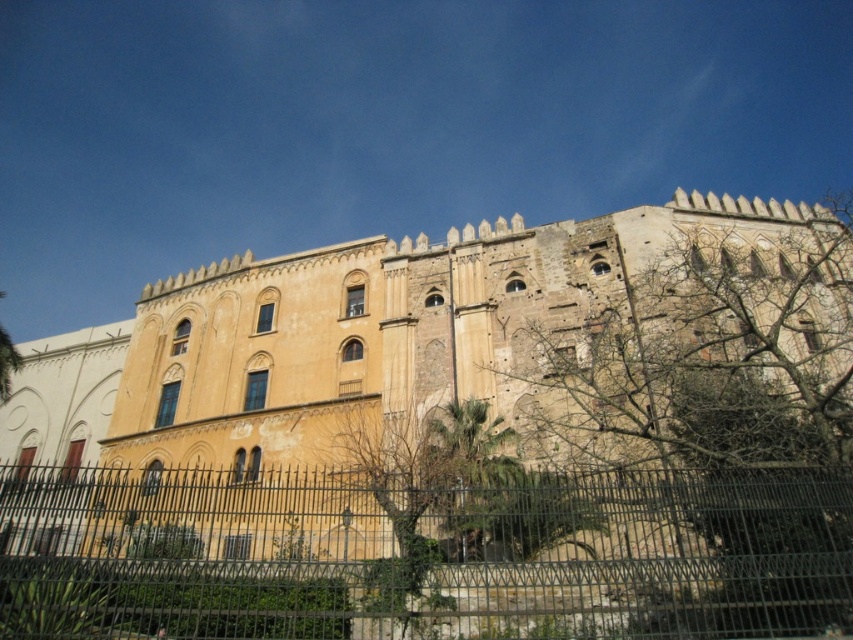
You are standing in front of the historic building and want to take a photo that includes both the yellow stone building at center and the bare branches at upper right. Based on their sizes in the image, which object should you focus on first to ensure both are in frame?

The yellow stone building at center is much taller than the bare branches at upper right, so you should focus on including the yellow stone building at center first to ensure both are in frame.

You are standing in front of a historic site and want to take a photo of the yellow stone building at center. If your camera has a maximum zoom range of 30 meters, will you be able to capture the entire building in focus without moving closer?

The distance between you and the yellow stone building at center is 29.61 meters, which is within the camera maximum zoom range of 30 meters. Therefore, you can capture the entire building in focus without moving closer.

You are standing in front of the historic building and want to take a photo that includes both the black metal fence at lower center and the bare branches at upper right. Which object will appear smaller in the photo?

The black metal fence at lower center will appear smaller in the photo because it occupies less space than the bare branches at upper right.